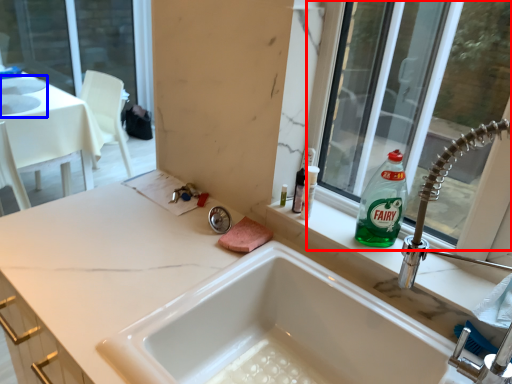
Question: Which object appears closest to the camera in this image, window (highlighted by a red box) or sink (highlighted by a blue box)?

Choices:
 (A) window
 (B) sink

Answer: (A)